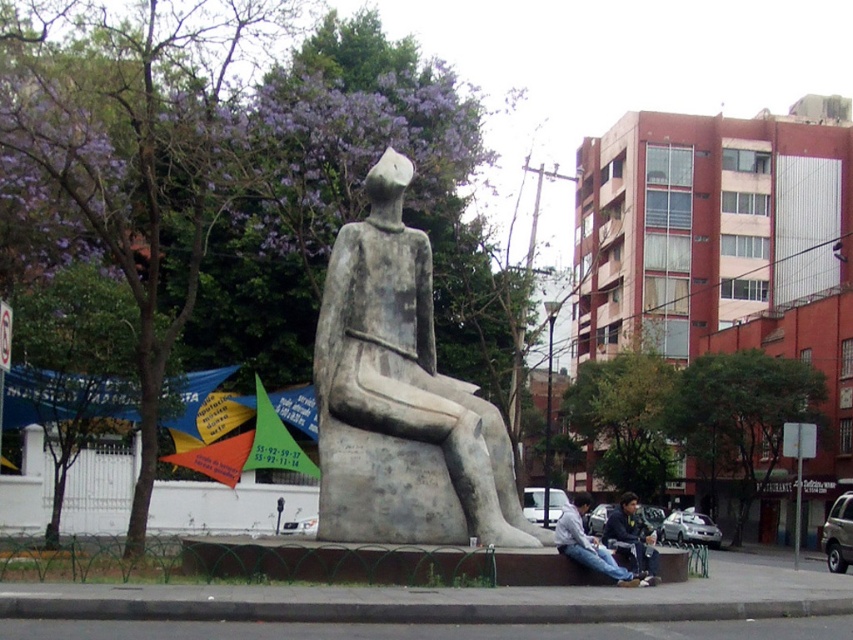
Question: Estimate the real-world distances between objects in this image. Which object is farther from the gray stone statue at center?

Choices:
 (A) dark blue jeans at lower center
 (B) gray concrete curb at lower center

Answer: (B)

Question: Is gray stone statue at center positioned in front of dark blue jeans at lower center?

Choices:
 (A) no
 (B) yes

Answer: (A)

Question: Which point is farther to the camera?

Choices:
 (A) (631, 532)
 (B) (387, 397)
 (C) (589, 550)
 (D) (265, 612)

Answer: (B)

Question: Among these points, which one is farthest from the camera?

Choices:
 (A) (610, 516)
 (B) (561, 525)
 (C) (405, 305)
 (D) (778, 611)

Answer: (C)

Question: Does denim jeans at lower center have a smaller size compared to dark blue jeans at lower center?

Choices:
 (A) yes
 (B) no

Answer: (A)

Question: Does gray concrete curb at lower center appear under denim jeans at lower center?

Choices:
 (A) no
 (B) yes

Answer: (B)